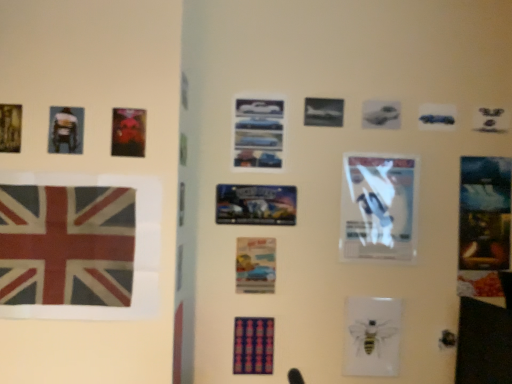
What do you see at coordinates (256, 204) in the screenshot? This screenshot has height=384, width=512. I see `metallic silver poster at center, which is the 3th poster from bottom to top` at bounding box center [256, 204].

In order to face matte black poster at upper left, which ranks as the 4th poster in bottom-to-top order, should I rotate leftwards or rightwards?

Turn left approximately 23.628 degrees to face it.

This screenshot has height=384, width=512. In order to click on matte black poster at upper left, which is the 5th poster from right to left in this screenshot , I will do `click(66, 130)`.

Measure the distance between point [56,191] and camera.

Point [56,191] and camera are 4.37 feet apart from each other.

Describe the element at coordinates (10, 128) in the screenshot. I see `metallic gold poster at upper left, which appears as the second poster when viewed from the top` at that location.

Where is `dark blue fabric poster at center, which is the third poster from back to front`? This screenshot has height=384, width=512. dark blue fabric poster at center, which is the third poster from back to front is located at coordinates (253, 345).

Would you consider matte black poster at upper left, the second poster when ordered from front to back, to be distant from metallic blue cars at center, which ranks as the second poster in back-to-front order?

matte black poster at upper left, the second poster when ordered from front to back, is actually quite close to metallic blue cars at center, which ranks as the second poster in back-to-front order.

Considering the sizes of objects matte black poster at upper left, which is the 5th poster from right to left, and metallic blue cars at center, which appears as the fifth poster when viewed from the front, in the image provided, who is taller, matte black poster at upper left, which is the 5th poster from right to left, or metallic blue cars at center, which appears as the fifth poster when viewed from the front,?

metallic blue cars at center, which appears as the fifth poster when viewed from the front.

Does watercolor paper poster at center, which is the third poster in right-to-left order, have a greater width compared to metallic gold poster at upper left, which appears as the first poster when viewed from the front?

No.

Considering the relative sizes of watercolor paper poster at center, positioned as the 1th poster in back-to-front order, and metallic gold poster at upper left, which appears as the second poster when viewed from the top, in the image provided, is watercolor paper poster at center, positioned as the 1th poster in back-to-front order, bigger than metallic gold poster at upper left, which appears as the second poster when viewed from the top,?

No.

Between watercolor paper poster at center, acting as the second poster starting from the bottom, and metallic gold poster at upper left, which appears as the second poster when viewed from the top, which one appears on the right side from the viewer's perspective?

Positioned to the right is watercolor paper poster at center, acting as the second poster starting from the bottom.

Is watercolor paper poster at center, positioned as the 1th poster in back-to-front order, positioned with its back to textured fabric flag at left?

No, textured fabric flag at left is not at the back of watercolor paper poster at center, positioned as the 1th poster in back-to-front order.

From the picture: Considering the relative positions of watercolor paper poster at center, acting as the second poster starting from the bottom, and textured fabric flag at left in the image provided, is watercolor paper poster at center, acting as the second poster starting from the bottom, behind textured fabric flag at left?

Yes, watercolor paper poster at center, acting as the second poster starting from the bottom, is further from the camera.

Measure the distance from watercolor paper poster at center, which is counted as the 4th poster, starting from the left, to textured fabric flag at left.

watercolor paper poster at center, which is counted as the 4th poster, starting from the left, is 22.93 inches from textured fabric flag at left.

Which object is wider, watercolor paper poster at center, which is counted as the 5th poster, starting from the top, or textured fabric flag at left?

Wider between the two is textured fabric flag at left.

From a real-world perspective, is matte black poster at upper left, the third poster positioned from the top, physically located above or below metallic gold poster at upper left, which appears as the 6th poster when viewed from the back?

Clearly, from a real-world perspective, matte black poster at upper left, the third poster positioned from the top, is below metallic gold poster at upper left, which appears as the 6th poster when viewed from the back.

From a real-world perspective, starting from the matte black poster at upper left, the second poster when ordered from front to back, which poster is the 1st one vertically above it? Please provide its 2D coordinates.

[(10, 128)]

How many degrees apart are the facing directions of matte black poster at upper left, the second poster when ordered from front to back, and metallic gold poster at upper left, which appears as the first poster when viewed from the front?

The angular difference between matte black poster at upper left, the second poster when ordered from front to back, and metallic gold poster at upper left, which appears as the first poster when viewed from the front, is 1.49 degrees.

Choose the correct answer: Is metallic blue cars at center, which appears as the fifth poster when viewed from the front, inside metallic gold poster at upper left, which appears as the second poster when viewed from the top, or outside it?

metallic blue cars at center, which appears as the fifth poster when viewed from the front, exists outside the volume of metallic gold poster at upper left, which appears as the second poster when viewed from the top.

Is there a large distance between metallic blue cars at center, which is the 6th poster in left-to-right order, and metallic gold poster at upper left, which appears as the first poster when viewed from the front?

No, there isn't a large distance between metallic blue cars at center, which is the 6th poster in left-to-right order, and metallic gold poster at upper left, which appears as the first poster when viewed from the front.

From the image's perspective, is metallic blue cars at center, which appears as the fifth poster when viewed from the front, located above metallic gold poster at upper left, which appears as the second poster when viewed from the top?

Yes, from the image's perspective, metallic blue cars at center, which appears as the fifth poster when viewed from the front, is above metallic gold poster at upper left, which appears as the second poster when viewed from the top.

Choose the correct answer: Is dark blue fabric poster at center, the 3th poster when ordered from left to right, inside metallic gold poster at upper left, which appears as the first poster when viewed from the front, or outside it?

dark blue fabric poster at center, the 3th poster when ordered from left to right, is outside metallic gold poster at upper left, which appears as the first poster when viewed from the front.

From a real-world perspective, does dark blue fabric poster at center, acting as the 1th poster starting from the bottom, sit lower than metallic gold poster at upper left, the fifth poster from the bottom?

Yes, from a real-world perspective, dark blue fabric poster at center, acting as the 1th poster starting from the bottom, is below metallic gold poster at upper left, the fifth poster from the bottom.

Based on their positions, is dark blue fabric poster at center, marked as the fourth poster in a right-to-left arrangement, located to the left or right of metallic gold poster at upper left, the fifth poster from the bottom?

dark blue fabric poster at center, marked as the fourth poster in a right-to-left arrangement, is to the right of metallic gold poster at upper left, the fifth poster from the bottom.

Between matte black poster at upper left, which ranks as the 4th poster in bottom-to-top order, and watercolor paper poster at center, which is counted as the 4th poster, starting from the left, which one has smaller width?

watercolor paper poster at center, which is counted as the 4th poster, starting from the left, is thinner.

Is matte black poster at upper left, which ranks as the 4th poster in bottom-to-top order, taller or shorter than watercolor paper poster at center, which is counted as the 4th poster, starting from the left?

In the image, matte black poster at upper left, which ranks as the 4th poster in bottom-to-top order, appears to be shorter than watercolor paper poster at center, which is counted as the 4th poster, starting from the left.

In the scene shown: From a real-world perspective, is matte black poster at upper left, the second poster when ordered from front to back, physically above watercolor paper poster at center, which is counted as the 4th poster, starting from the left?

Yes, from a real-world perspective, matte black poster at upper left, the second poster when ordered from front to back, is over watercolor paper poster at center, which is counted as the 4th poster, starting from the left

Is point (75, 119) positioned after point (257, 284)?

No, (75, 119) is closer to viewer.

This screenshot has height=384, width=512. In order to click on the 3rd poster behind the matte black poster at upper left, the second poster when ordered from front to back, counting from the anchor's position in this screenshot , I will do `click(258, 133)`.

Where is `the 5th poster in front of the watercolor paper poster at center, which is the sixth poster from front to back, counting from the anchor's position`? The width and height of the screenshot is (512, 384). the 5th poster in front of the watercolor paper poster at center, which is the sixth poster from front to back, counting from the anchor's position is located at coordinates (10, 128).

Based on their spatial positions, is watercolor paper poster at center, which is the third poster in right-to-left order, or dark blue fabric poster at center, which is the third poster from back to front, closer to metallic gold poster at upper left, which appears as the first poster when viewed from the front?

watercolor paper poster at center, which is the third poster in right-to-left order, is positioned closer to the anchor metallic gold poster at upper left, which appears as the first poster when viewed from the front.

Estimate the real-world distances between objects in this image. Which object is closer to dark blue fabric poster at center, the 6th poster in the top-to-bottom sequence, metallic silver poster at center, which appears as the 4th poster when viewed from the back, or metallic gold poster at upper left, the 6th poster in the right-to-left sequence?

metallic silver poster at center, which appears as the 4th poster when viewed from the back, lies closer to dark blue fabric poster at center, the 6th poster in the top-to-bottom sequence, than the other object.

Based on their spatial positions, is watercolor paper poster at center, positioned as the 1th poster in back-to-front order, or dark blue fabric poster at center, which ranks as the fourth poster in front-to-back order, further from matte black poster at upper left, which ranks as the 4th poster in bottom-to-top order?

dark blue fabric poster at center, which ranks as the fourth poster in front-to-back order.

Estimate the real-world distances between objects in this image. Which object is closer to watercolor paper poster at center, which is counted as the 4th poster, starting from the left, dark blue fabric poster at center, acting as the 1th poster starting from the bottom, or metallic silver poster at center, which is the fourth poster from top to bottom?

metallic silver poster at center, which is the fourth poster from top to bottom, is closer to watercolor paper poster at center, which is counted as the 4th poster, starting from the left.

When comparing their distances from matte black poster at upper left, which is the 5th poster from right to left, does metallic silver poster at center, arranged as the 2th poster when viewed from the right, or metallic gold poster at upper left, the fifth poster from the bottom, seem closer?

metallic gold poster at upper left, the fifth poster from the bottom, lies closer to matte black poster at upper left, which is the 5th poster from right to left, than the other object.

Considering their positions, is dark blue fabric poster at center, marked as the fourth poster in a right-to-left arrangement, positioned closer to metallic blue cars at center, which appears as the fifth poster when viewed from the front, than watercolor paper poster at center, which is the sixth poster from front to back?

watercolor paper poster at center, which is the sixth poster from front to back, lies closer to metallic blue cars at center, which appears as the fifth poster when viewed from the front, than the other object.

Looking at the image, which one is located closer to watercolor paper poster at center, which is the third poster in right-to-left order, dark blue fabric poster at center, acting as the 1th poster starting from the bottom, or matte black poster at upper left, marked as the fifth poster in a back-to-front arrangement?

dark blue fabric poster at center, acting as the 1th poster starting from the bottom, is positioned closer to the anchor watercolor paper poster at center, which is the third poster in right-to-left order.

Estimate the real-world distances between objects in this image. Which object is closer to metallic blue cars at center, which is the 6th poster in left-to-right order, metallic gold poster at upper left, which appears as the second poster when viewed from the top, or metallic silver poster at center, which is the fourth poster from top to bottom?

metallic silver poster at center, which is the fourth poster from top to bottom.

The width and height of the screenshot is (512, 384). Identify the location of flag between metallic blue cars at center, which is the 6th poster in left-to-right order, and dark blue fabric poster at center, marked as the fourth poster in a right-to-left arrangement, vertically. (66, 245).

Identify the location of flag between metallic gold poster at upper left, the fifth poster from the bottom, and watercolor paper poster at center, which is counted as the 5th poster, starting from the top, in the horizontal direction. (66, 245).

Find the location of a particular element. This screenshot has width=512, height=384. flag between matte black poster at upper left, marked as the fifth poster in a back-to-front arrangement, and dark blue fabric poster at center, which is the third poster from back to front, vertically is located at coordinates (x=66, y=245).

Locate an element on the screen. flag situated between metallic gold poster at upper left, positioned as the 1th poster in left-to-right order, and dark blue fabric poster at center, acting as the 1th poster starting from the bottom, from left to right is located at coordinates (66, 245).